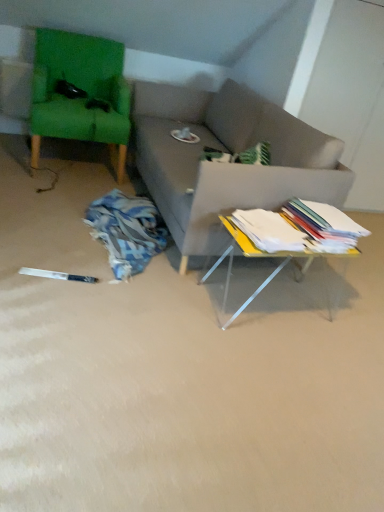
Find the location of a particular element. free space above yellow acrylic table at lower right (from a real-world perspective) is located at coordinates (278, 228).